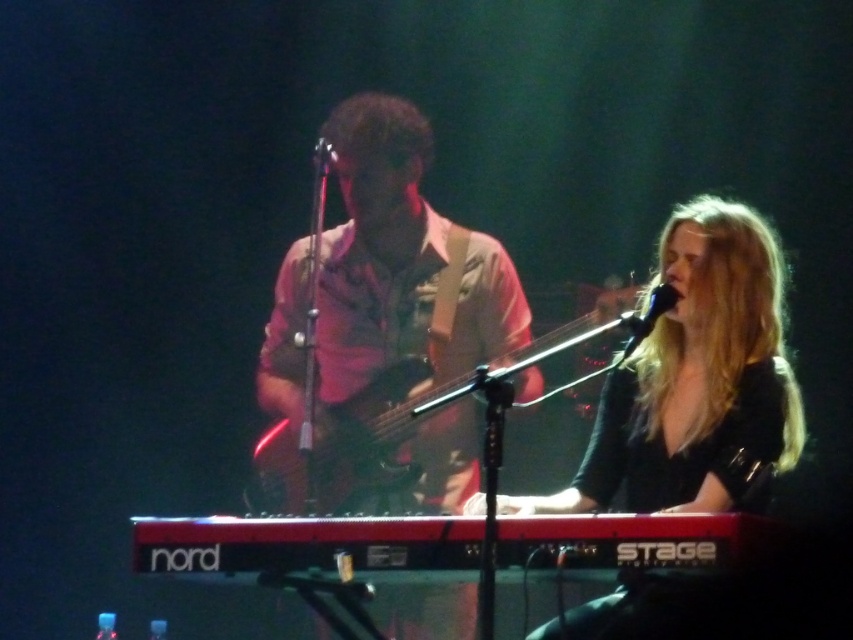
Question: Which object appears closest to the camera in this image?

Choices:
 (A) black matte microphone at upper center
 (B) wooden electric bass at center
 (C) matte pink shirt at center

Answer: (A)

Question: Estimate the real-world distances between objects in this image. Which object is closer to the wooden electric bass at center?

Choices:
 (A) metallic silver microphone at center
 (B) black matte microphone at upper center
 (C) black plastic keyboard at lower center

Answer: (B)

Question: Does black matte keyboard at center appear under wooden electric bass at center?

Choices:
 (A) yes
 (B) no

Answer: (B)

Question: Which point is closer to the camera taking this photo?

Choices:
 (A) (352, 394)
 (B) (688, 368)
 (C) (328, 154)
 (D) (340, 269)

Answer: (B)

Question: Can you confirm if black plastic keyboard at lower center is positioned to the left of black matte microphone at upper center?

Choices:
 (A) no
 (B) yes

Answer: (B)

Question: Does matte pink shirt at center come in front of metallic silver microphone at center?

Choices:
 (A) yes
 (B) no

Answer: (A)